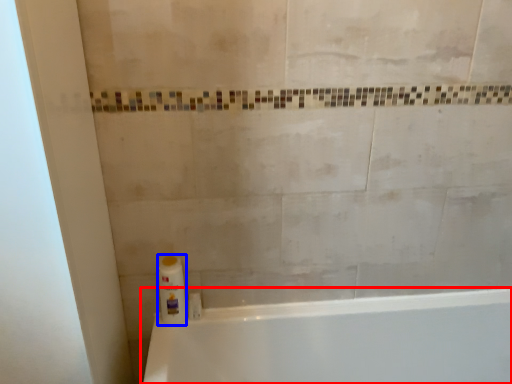
Question: Which of the following is the farthest to the observer, bathtub (highlighted by a red box) or cleaning product (highlighted by a blue box)?

Choices:
 (A) bathtub
 (B) cleaning product

Answer: (B)